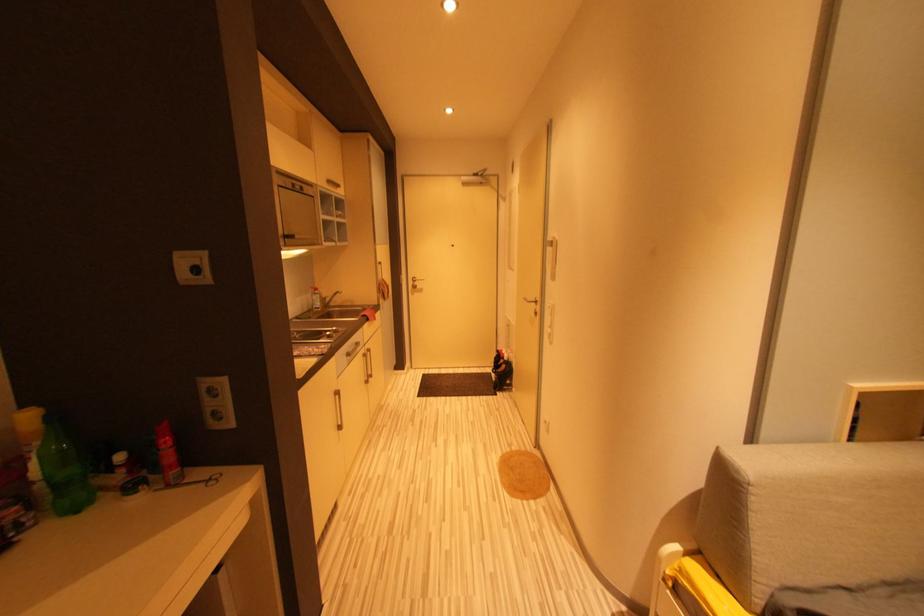
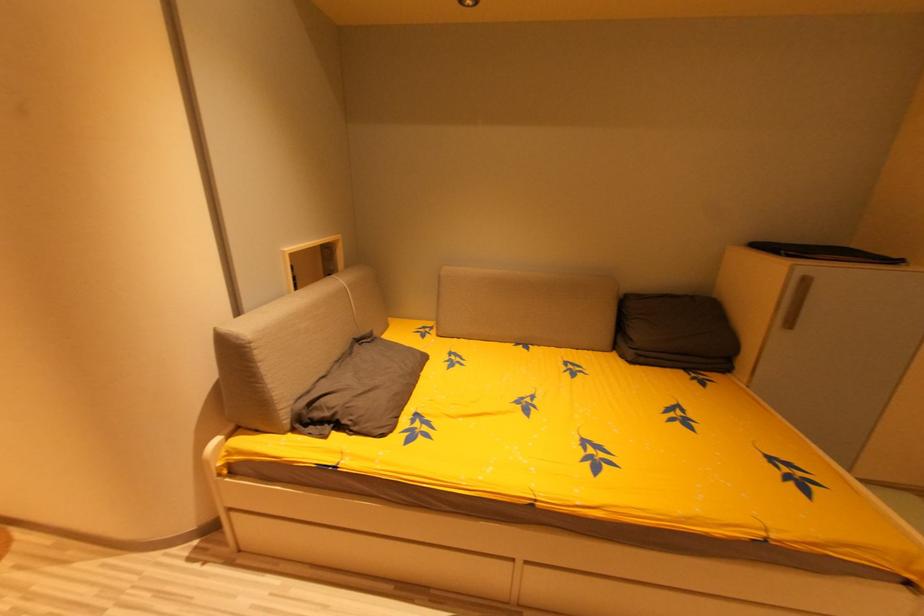
The images are taken continuously from a first-person perspective. In which direction is your viewpoint rotating?

The camera's rotation is toward right-down.